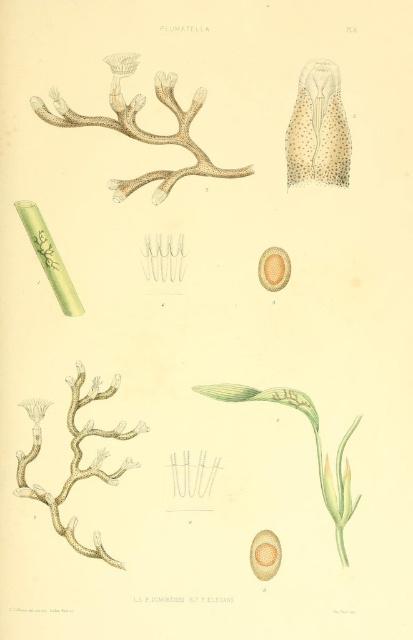
Based on the botanical illustration provided, where exactly is the spotted beige coral at upper right located in terms of coordinates?

The spotted beige coral at upper right is located at point (318, 129).

You are a researcher examining the botanical illustration. You need to locate the translucent white coral at center. According to the grid coordinates provided in the scene, what are its exact coordinates?

The translucent white coral at center is located at point (75,460).

You are an assistant who needs to locate the translucent white coral at upper left in the botanical illustration. What are its coordinates?

The translucent white coral at upper left is located at coordinates point (x=140, y=129).